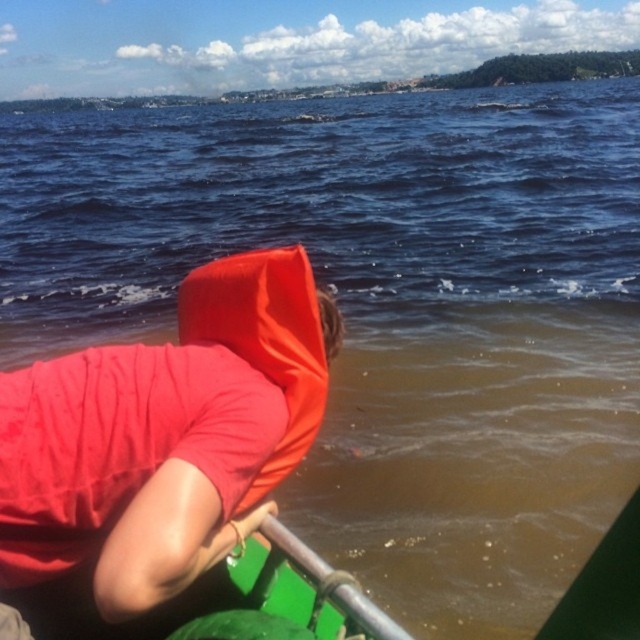
Question: Among these points, which one is farthest from the camera?

Choices:
 (A) (237, 352)
 (B) (83, 477)

Answer: (A)

Question: Does matte red life vest at left lie in front of matte orange life jacket at center?

Choices:
 (A) yes
 (B) no

Answer: (A)

Question: Which of the following is the closest to the observer?

Choices:
 (A) (220, 445)
 (B) (288, 451)

Answer: (A)

Question: Considering the relative positions of matte red life vest at left and matte orange life jacket at center in the image provided, where is matte red life vest at left located with respect to matte orange life jacket at center?

Choices:
 (A) left
 (B) right

Answer: (A)

Question: Can you confirm if matte red life vest at left is wider than matte orange life jacket at center?

Choices:
 (A) yes
 (B) no

Answer: (A)